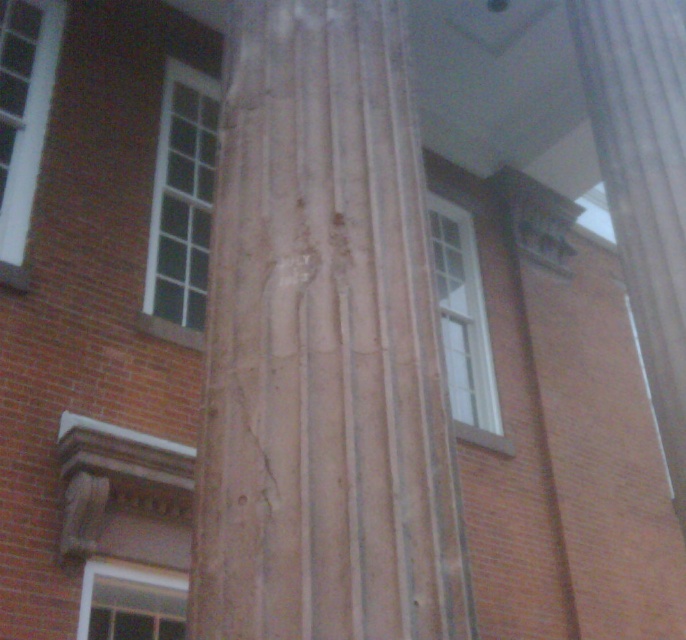
Between smooth brown column at center and smooth stone column at center, which one has less height?

Standing shorter between the two is smooth brown column at center.

Who is more distant from viewer, (x=255, y=51) or (x=619, y=74)?

Point (x=619, y=74)

Locate an element on the screen. The image size is (686, 640). smooth brown column at center is located at coordinates (322, 346).